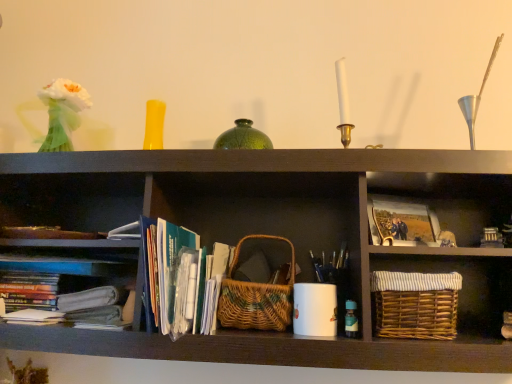
Measure the distance between point (353, 307) and camera.

A distance of 39.13 inches exists between point (353, 307) and camera.

Describe the element at coordinates (256, 297) in the screenshot. Image resolution: width=512 pixels, height=384 pixels. I see `woven natural basket at center, which ranks as the 2th basket in right-to-left order` at that location.

The height and width of the screenshot is (384, 512). What are the coordinates of `woven natural basket at center, the first basket when ordered from left to right` in the screenshot? It's located at (256, 297).

Image resolution: width=512 pixels, height=384 pixels. I want to click on woven brown basket at lower right, which ranks as the 1th basket in right-to-left order, so click(415, 304).

Is woven natural basket at center, the first basket when ordered from left to right, inside green paperbacks at center?

No, woven natural basket at center, the first basket when ordered from left to right, is not inside green paperbacks at center.

Which is behind, green paperbacks at center or woven natural basket at center, which ranks as the 2th basket in right-to-left order?

woven natural basket at center, which ranks as the 2th basket in right-to-left order, is further away from the camera.

Is green paperbacks at center positioned with its back to woven natural basket at center, which ranks as the 2th basket in right-to-left order?

No, woven natural basket at center, which ranks as the 2th basket in right-to-left order, is not at the back of green paperbacks at center.

From the image's perspective, does green paperbacks at center appear lower than woven natural basket at center, the first basket when ordered from left to right?

No, from the image's perspective, green paperbacks at center is not below woven natural basket at center, the first basket when ordered from left to right.

The width and height of the screenshot is (512, 384). I want to click on basket on the left of translucent glass bottle at lower right, so click(256, 297).

Which is behind, point (232, 273) or point (354, 315)?

The point (232, 273) is behind.

Is woven natural basket at center, the first basket when ordered from left to right, turned away from translucent glass bottle at lower right?

woven natural basket at center, the first basket when ordered from left to right, is not turned away from translucent glass bottle at lower right.

From a real-world perspective, which object stands above the other?

woven natural basket at center, which ranks as the 2th basket in right-to-left order, is physically above.

Which object is positioned more to the left, translucent glass bottle at lower right or green paperbacks at center?

Positioned to the left is green paperbacks at center.

Measure the distance from translucent glass bottle at lower right to green paperbacks at center.

translucent glass bottle at lower right is 14.37 inches away from green paperbacks at center.

From a real-world perspective, is translucent glass bottle at lower right over green paperbacks at center?

Incorrect, from a real-world perspective, translucent glass bottle at lower right is lower than green paperbacks at center.

Considering the relative sizes of translucent glass bottle at lower right and green paperbacks at center in the image provided, is translucent glass bottle at lower right bigger than green paperbacks at center?

Actually, translucent glass bottle at lower right might be smaller than green paperbacks at center.

Could you measure the distance between woven brown basket at lower right, which ranks as the 1th basket in right-to-left order, and green paperbacks at center?

woven brown basket at lower right, which ranks as the 1th basket in right-to-left order, is 15.41 inches from green paperbacks at center.

Could you tell me if woven brown basket at lower right, which ranks as the 1th basket in right-to-left order, is facing green paperbacks at center?

No, woven brown basket at lower right, which ranks as the 1th basket in right-to-left order, is not oriented towards green paperbacks at center.

Identify the location of book lying on the left of woven brown basket at lower right, which ranks as the 1th basket in right-to-left order. (183, 279).

Who is smaller, matte paper photo at center right or woven natural basket at center, the first basket when ordered from left to right?

matte paper photo at center right.

Which basket is the 2nd one when counting from the left side of the matte paper photo at center right? Please provide its 2D coordinates.

[(256, 297)]

From a real-world perspective, is matte paper photo at center right positioned over woven natural basket at center, the first basket when ordered from left to right, based on gravity?

Yes, from a real-world perspective, matte paper photo at center right is on top of woven natural basket at center, the first basket when ordered from left to right.

Is matte paper photo at center right oriented towards woven natural basket at center, the first basket when ordered from left to right?

No, matte paper photo at center right is not facing towards woven natural basket at center, the first basket when ordered from left to right.

From the image's perspective, relative to woven natural basket at center, which ranks as the 2th basket in right-to-left order, is woven brown basket at lower right, the 2th basket when ordered from left to right, above or below?

From the image's perspective, woven brown basket at lower right, the 2th basket when ordered from left to right, appears below woven natural basket at center, which ranks as the 2th basket in right-to-left order.

From a real-world perspective, which object rests below the other?

From a 3D spatial view, woven brown basket at lower right, which ranks as the 1th basket in right-to-left order, is below.

Is woven brown basket at lower right, which ranks as the 1th basket in right-to-left order, far from woven natural basket at center, the first basket when ordered from left to right?

They are positioned close to each other.

Considering the sizes of woven brown basket at lower right, which ranks as the 1th basket in right-to-left order, and woven natural basket at center, the first basket when ordered from left to right, in the image, is woven brown basket at lower right, which ranks as the 1th basket in right-to-left order, wider or thinner than woven natural basket at center, the first basket when ordered from left to right,?

In the image, woven brown basket at lower right, which ranks as the 1th basket in right-to-left order, appears to be wider than woven natural basket at center, the first basket when ordered from left to right.

Does woven natural basket at center, the first basket when ordered from left to right, have a lesser width compared to matte paper photo at center right?

Incorrect, the width of woven natural basket at center, the first basket when ordered from left to right, is not less than that of matte paper photo at center right.

How different are the orientations of woven natural basket at center, the first basket when ordered from left to right, and matte paper photo at center right in degrees?

They differ by 23.5 degrees in their facing directions.

Is woven natural basket at center, which ranks as the 2th basket in right-to-left order, to the left of matte paper photo at center right from the viewer's perspective?

Yes, woven natural basket at center, which ranks as the 2th basket in right-to-left order, is to the left of matte paper photo at center right.

How distant is woven natural basket at center, the first basket when ordered from left to right, from matte paper photo at center right?

They are 11.09 inches apart.

From a real-world perspective, which basket is the 1st one underneath the green paperbacks at center? Please provide its 2D coordinates.

[(256, 297)]

From a real-world perspective, starting from the translucent glass bottle at lower right, which basket is the 2nd one vertically above it? Please provide its 2D coordinates.

[(256, 297)]

Looking at the image, which one is located closer to woven natural basket at center, the first basket when ordered from left to right, matte paper photo at center right or green paperbacks at center?

Based on the image, green paperbacks at center appears to be nearer to woven natural basket at center, the first basket when ordered from left to right.

Which object lies further to the anchor point green paperbacks at center, translucent glass bottle at lower right or woven natural basket at center, the first basket when ordered from left to right?

Based on the image, translucent glass bottle at lower right appears to be further to green paperbacks at center.

In the scene shown: When comparing their distances from green paperbacks at center, does woven brown basket at lower right, the 2th basket when ordered from left to right, or woven natural basket at center, which ranks as the 2th basket in right-to-left order, seem closer?

The object closer to green paperbacks at center is woven natural basket at center, which ranks as the 2th basket in right-to-left order.

Based on their spatial positions, is woven natural basket at center, the first basket when ordered from left to right, or green paperbacks at center further from translucent glass bottle at lower right?

Based on the image, green paperbacks at center appears to be further to translucent glass bottle at lower right.

Estimate the real-world distances between objects in this image. Which object is further from woven brown basket at lower right, the 2th basket when ordered from left to right, woven natural basket at center, the first basket when ordered from left to right, or matte paper photo at center right?

woven natural basket at center, the first basket when ordered from left to right, lies further to woven brown basket at lower right, the 2th basket when ordered from left to right, than the other object.

Which object lies further to the anchor point matte paper photo at center right, woven natural basket at center, which ranks as the 2th basket in right-to-left order, or green paperbacks at center?

green paperbacks at center lies further to matte paper photo at center right than the other object.

Looking at the image, which one is located closer to translucent glass bottle at lower right, woven brown basket at lower right, the 2th basket when ordered from left to right, or woven natural basket at center, the first basket when ordered from left to right?

woven brown basket at lower right, the 2th basket when ordered from left to right.

When comparing their distances from woven natural basket at center, the first basket when ordered from left to right, does translucent glass bottle at lower right or green paperbacks at center seem closer?

green paperbacks at center is positioned closer to the anchor woven natural basket at center, the first basket when ordered from left to right.

Identify the location of bottle between woven natural basket at center, the first basket when ordered from left to right, and matte paper photo at center right, in the horizontal direction. (351, 319).

The image size is (512, 384). Identify the location of basket between green paperbacks at center and translucent glass bottle at lower right in the horizontal direction. (256, 297).

Identify the location of basket between green paperbacks at center and woven brown basket at lower right, the 2th basket when ordered from left to right, in the horizontal direction. Image resolution: width=512 pixels, height=384 pixels. pyautogui.click(x=256, y=297).

Where is `bottle between woven natural basket at center, which ranks as the 2th basket in right-to-left order, and woven brown basket at lower right, which ranks as the 1th basket in right-to-left order, from left to right`? bottle between woven natural basket at center, which ranks as the 2th basket in right-to-left order, and woven brown basket at lower right, which ranks as the 1th basket in right-to-left order, from left to right is located at coordinates (351, 319).